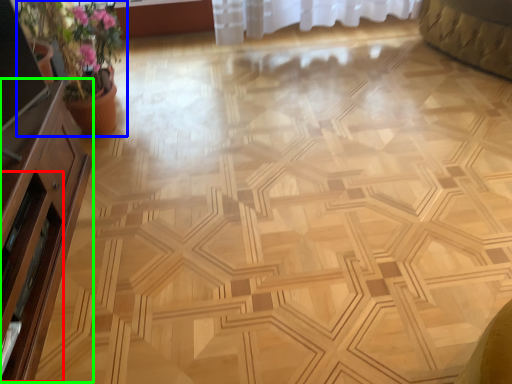
Question: Estimate the real-world distances between objects in this image. Which object is closer to screen door (highlighted by a red box), houseplant (highlighted by a blue box) or dresser (highlighted by a green box)?

Choices:
 (A) houseplant
 (B) dresser

Answer: (B)